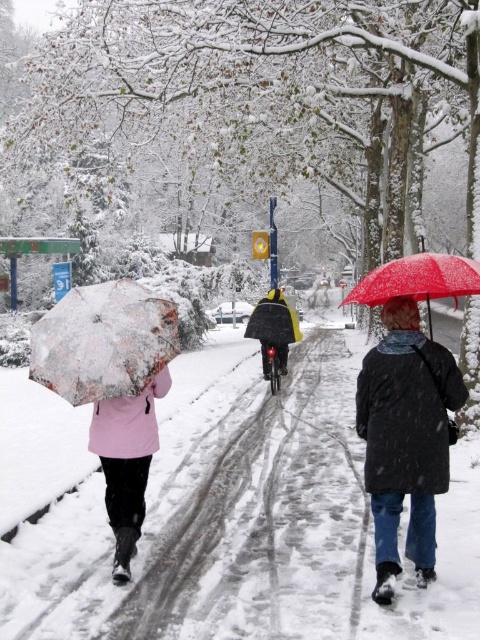
What do you see at coordinates (103, 340) in the screenshot?
I see `translucent snow-covered umbrella at left` at bounding box center [103, 340].

The height and width of the screenshot is (640, 480). In order to click on translucent snow-covered umbrella at left in this screenshot , I will do `click(103, 340)`.

Does matte pink coat at left have a greater width compared to red matte umbrella at right?

No, matte pink coat at left is not wider than red matte umbrella at right.

Find the location of a particular element. The width and height of the screenshot is (480, 640). matte pink coat at left is located at coordinates coord(127,461).

Identify the location of matte pink coat at left. The image size is (480, 640). (127, 461).

From the picture: Does white snow-covered pavement at center have a greater width compared to black matte coat at center?

Correct, the width of white snow-covered pavement at center exceeds that of black matte coat at center.

Locate an element on the screen. Image resolution: width=480 pixels, height=640 pixels. white snow-covered pavement at center is located at coordinates (244, 518).